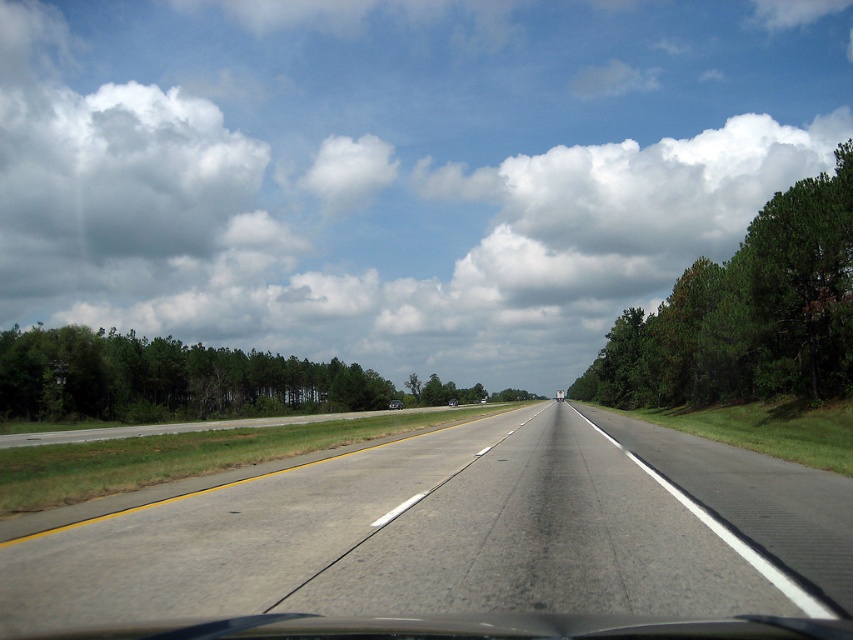
You are driving on the highway and see a point marked at coordinates (167, 380). What is located at that point?

At point (167, 380) lies green leafy trees at left.

You are driving on the highway and see the point marked at coordinates (746,314). What object is located at that point?

The point at coordinates (746,314) marks a green leafy tree at right.